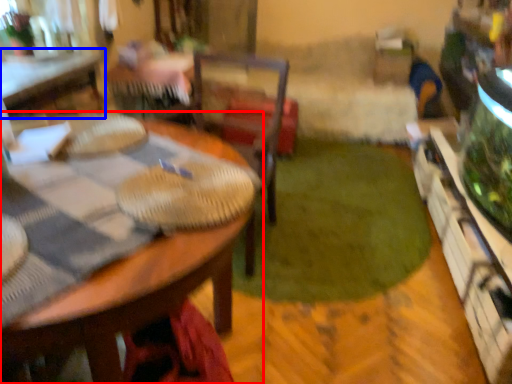
Question: Which object appears closest to the camera in this image, table (highlighted by a red box) or table (highlighted by a blue box)?

Choices:
 (A) table
 (B) table

Answer: (A)